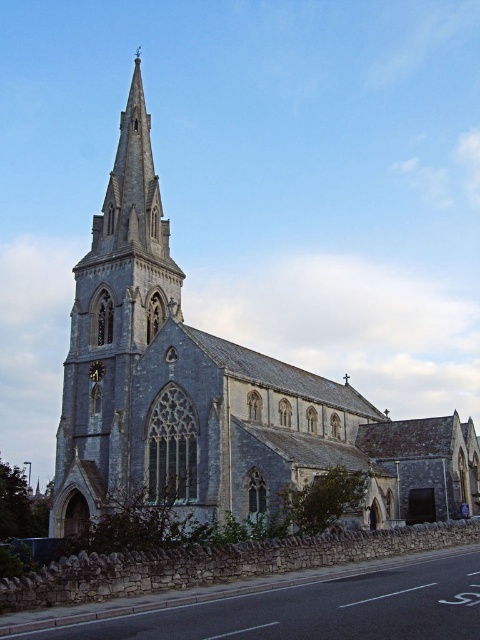
Between point (305, 460) and point (103, 365), which one is positioned behind?

The point (103, 365) is more distant.

Who is more forward, (x=335, y=440) or (x=96, y=376)?

Positioned in front is point (x=96, y=376).

Who is more forward, (254, 403) or (104, 372)?

Point (254, 403) is in front.

The height and width of the screenshot is (640, 480). I want to click on gray stone church at center, so click(216, 394).